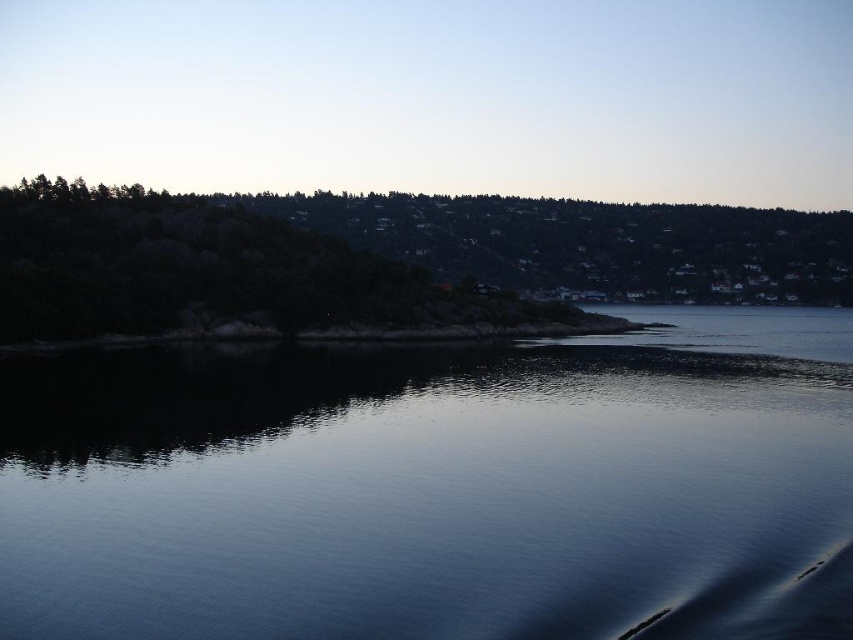
You are an artist planning to paint the coastal scene. You want to ensure that the dark reflective water at center and the green textured rock at upper center are proportionally accurate. Which object should you make smaller in your painting?

The dark reflective water at center should be made smaller because it occupies less space than the green textured rock at upper center according to the description.

You are a hiker who wants to cross the dark reflective water at center to reach the green textured rock at upper center. Given that your hiking boots can handle up to 100 meters of distance, is this path feasible?

The dark reflective water at center and green textured rock at upper center are 106.08 meters apart from each other. Since your hiking boots can handle up to 100 meters, the distance exceeds the limit, so the path is not feasible.